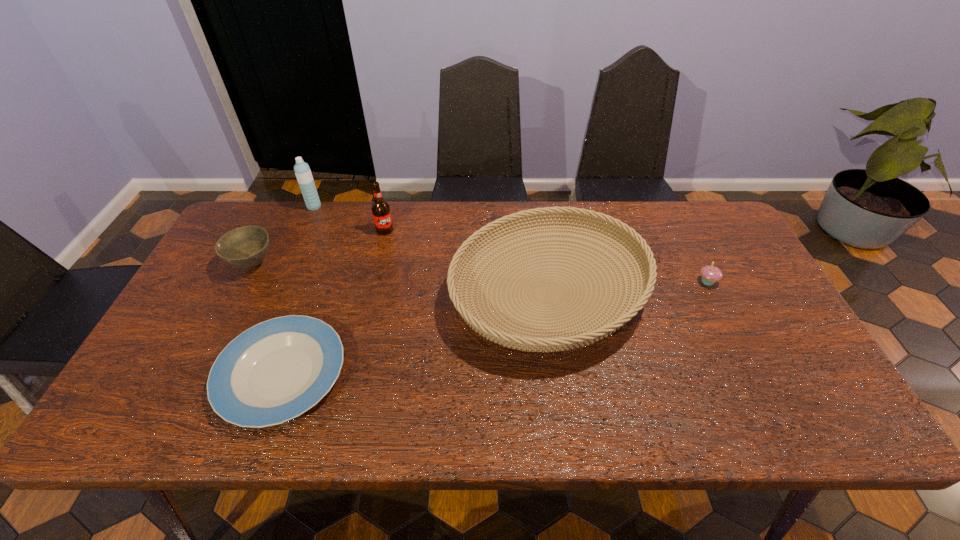
Identify the location of unoccupied area between the plate and the root beer. The height and width of the screenshot is (540, 960). (333, 302).

At what (x,y) coordinates should I click in order to perform the action: click on the fifth closest object to the bowl. Please return your answer as a coordinate pair (x, y). The height and width of the screenshot is (540, 960). Looking at the image, I should click on (710, 274).

Locate an element on the screen. The width and height of the screenshot is (960, 540). object that is the second nearest to the plate is located at coordinates (514, 336).

Find the location of `free space that satisfies the following two spatial constraints: 1. on the back side of the basket; 2. on the right side of the cupcake`. free space that satisfies the following two spatial constraints: 1. on the back side of the basket; 2. on the right side of the cupcake is located at coordinates (547, 281).

The image size is (960, 540). Find the location of `free location that satisfies the following two spatial constraints: 1. on the front side of the basket; 2. on the left side of the farthest object`. free location that satisfies the following two spatial constraints: 1. on the front side of the basket; 2. on the left side of the farthest object is located at coordinates (276, 293).